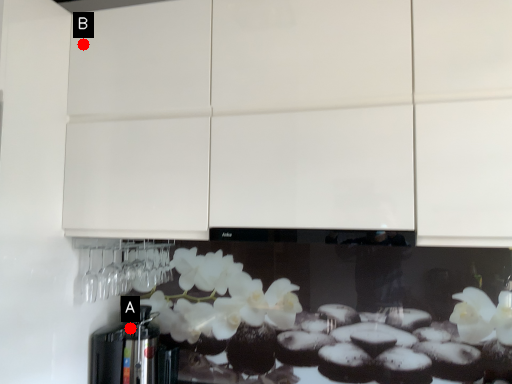
Question: Two points are circled on the image, labeled by A and B beside each circle. Which point is further to the camera?

Choices:
 (A) A is further
 (B) B is further

Answer: (A)